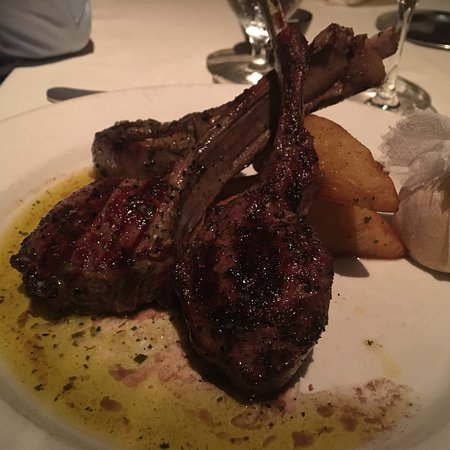
Locate an element on the screen. This screenshot has width=450, height=450. silver plate is located at coordinates (432, 24).